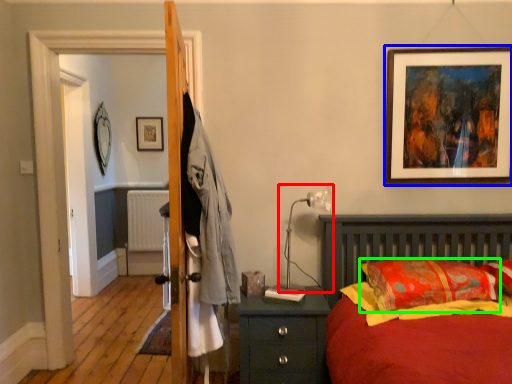
Question: Which is nearer to the table lamp (highlighted by a red box)? picture frame (highlighted by a blue box) or pillow (highlighted by a green box).

Choices:
 (A) picture frame
 (B) pillow

Answer: (B)